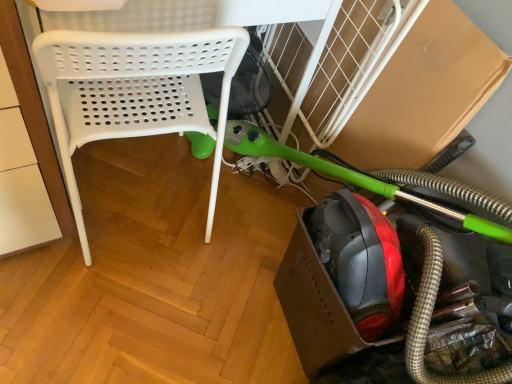
Question: Considering the relative positions of green rubber garden hose at lower right and white plastic chair at left in the image provided, is green rubber garden hose at lower right to the left or to the right of white plastic chair at left?

Choices:
 (A) right
 (B) left

Answer: (A)

Question: Relative to white plastic chair at left, is green rubber garden hose at lower right in front or behind?

Choices:
 (A) front
 (B) behind

Answer: (A)

Question: Would you say green rubber garden hose at lower right is inside or outside white plastic chair at left?

Choices:
 (A) inside
 (B) outside

Answer: (B)

Question: From a real-world perspective, is white plastic chair at left positioned above or below green rubber garden hose at lower right?

Choices:
 (A) below
 (B) above

Answer: (B)

Question: In terms of width, does white plastic chair at left look wider or thinner when compared to green rubber garden hose at lower right?

Choices:
 (A) wide
 (B) thin

Answer: (A)

Question: Is point (143, 69) positioned closer to the camera than point (372, 322)?

Choices:
 (A) farther
 (B) closer

Answer: (B)

Question: Is white plastic chair at left bigger or smaller than green rubber garden hose at lower right?

Choices:
 (A) big
 (B) small

Answer: (A)